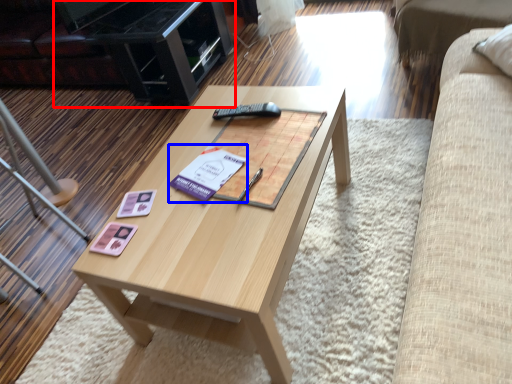
Question: Among these objects, which one is nearest to the camera, entertainment center (highlighted by a red box) or paperback book (highlighted by a blue box)?

Choices:
 (A) entertainment center
 (B) paperback book

Answer: (B)